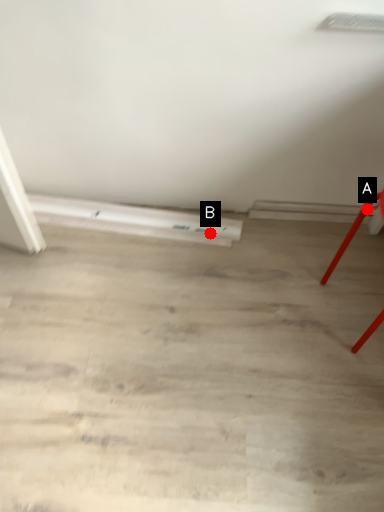
Question: Two points are circled on the image, labeled by A and B beside each circle. Which point is farther to the camera?

Choices:
 (A) A is further
 (B) B is further

Answer: (B)